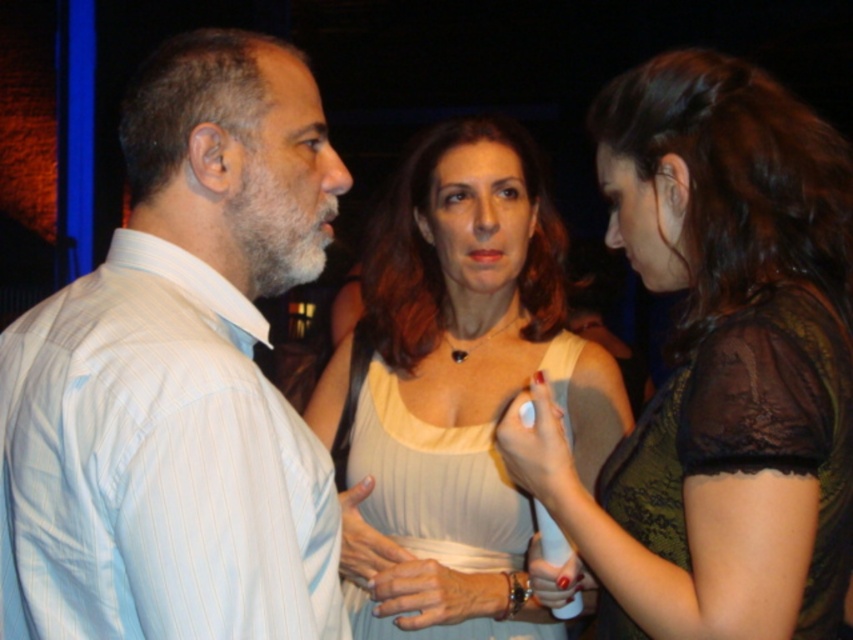
Question: In this image, where is black lace dress at right located relative to white ribbed fabric dress at center?

Choices:
 (A) right
 (B) left

Answer: (A)

Question: Can you confirm if white striped shirt at left is thinner than black lace dress at right?

Choices:
 (A) yes
 (B) no

Answer: (B)

Question: Which point is closer to the camera?

Choices:
 (A) white ribbed fabric dress at center
 (B) matte white dress at center

Answer: (B)

Question: Can you confirm if white striped shirt at left is wider than black lace dress at right?

Choices:
 (A) yes
 (B) no

Answer: (A)

Question: Which of the following is the closest to the observer?

Choices:
 (A) (636, 115)
 (B) (558, 376)
 (C) (408, 435)
 (D) (775, 346)

Answer: (D)

Question: Among these objects, which one is farthest from the camera?

Choices:
 (A) black lace dress at right
 (B) matte green dress at center
 (C) matte white dress at center

Answer: (C)